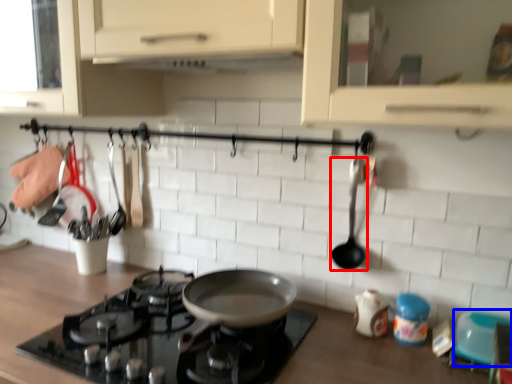
Question: Which object is further to the camera taking this photo, spoon (highlighted by a red box) or appliance (highlighted by a blue box)?

Choices:
 (A) spoon
 (B) appliance

Answer: (A)